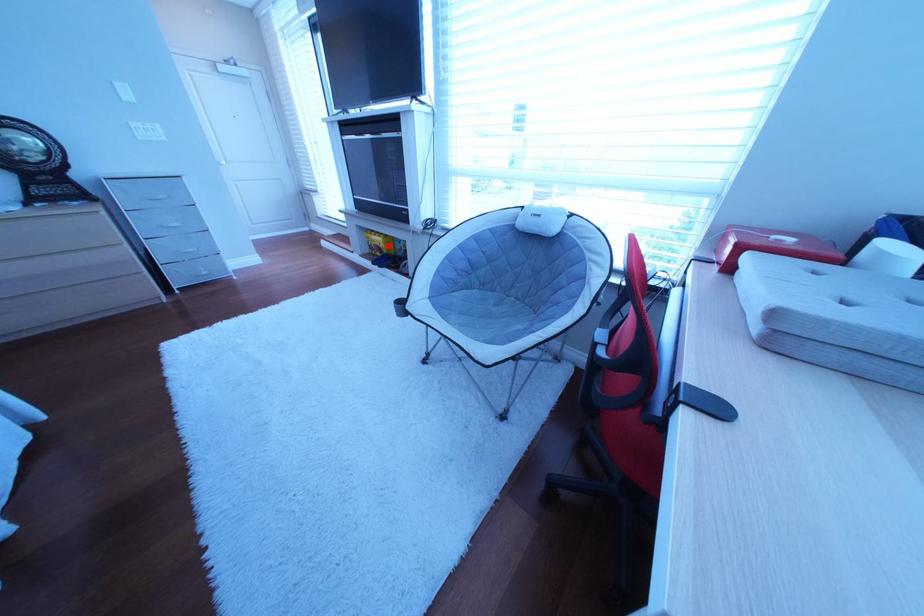
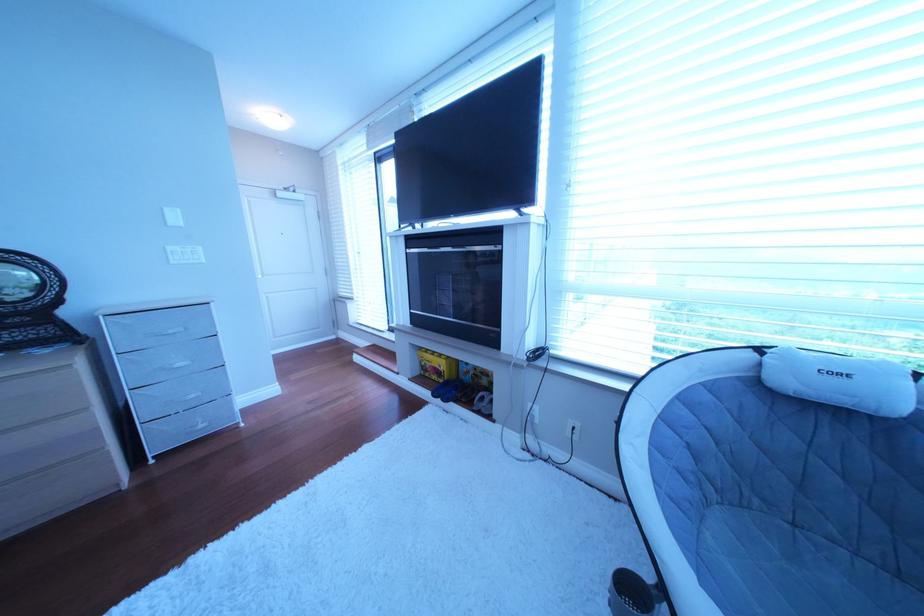
Question: I am providing you with two images of the same scene from different viewpoints. Given a red point in image1, look at the same physical point in image2. Is it:

Choices:
 (A) Closer to the viewpoint
 (B) Farther from the viewpoint

Answer: (B)